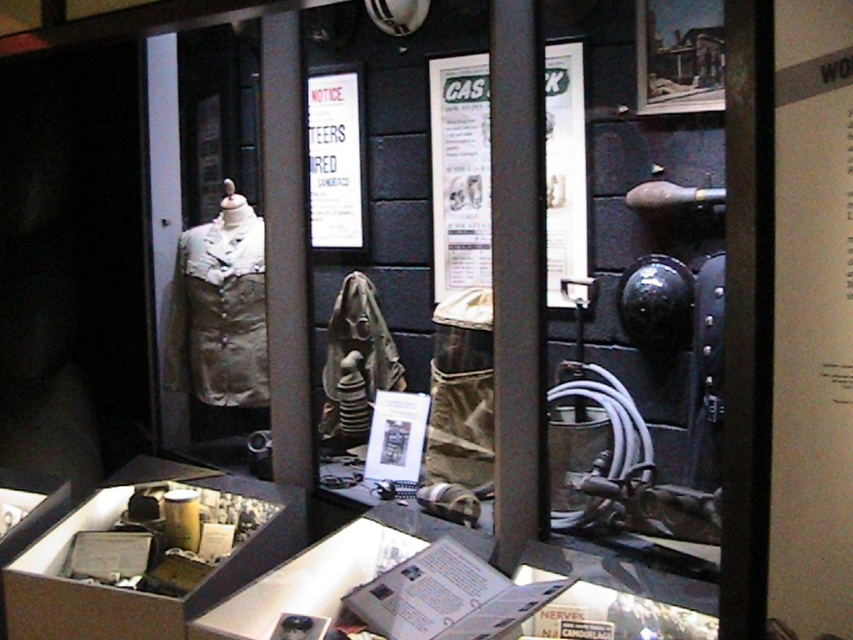
Question: Which point is closer to the camera taking this photo?

Choices:
 (A) coord(149,602)
 (B) coord(440,276)

Answer: (A)

Question: Considering the relative positions of white paper at center and metallic gray box at lower left in the image provided, where is white paper at center located with respect to metallic gray box at lower left?

Choices:
 (A) above
 (B) below

Answer: (A)

Question: Is the position of white paper at center more distant than that of metallic gray box at lower left?

Choices:
 (A) no
 (B) yes

Answer: (B)

Question: Which point is farther to the camera?

Choices:
 (A) (108, 637)
 (B) (550, 172)

Answer: (B)

Question: Where is white paper at center located in relation to metallic gray box at lower left in the image?

Choices:
 (A) left
 (B) right

Answer: (B)